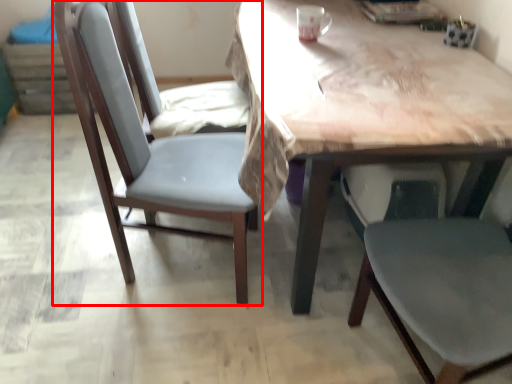
Question: From the image's perspective, what is the correct spatial positioning of chair (annotated by the red box) in reference to table?

Choices:
 (A) above
 (B) below

Answer: (B)